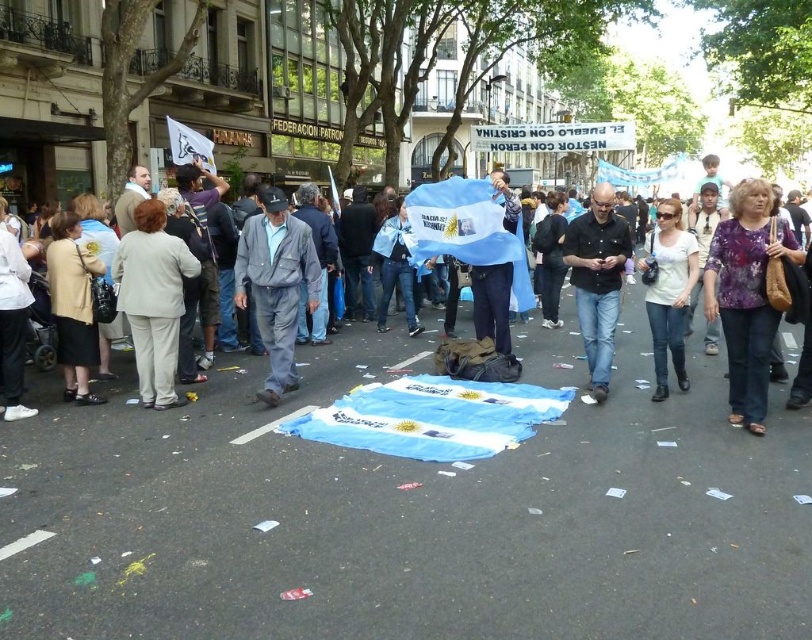
Question: Does blue fabric flag at center have a smaller size compared to black shirt at center?

Choices:
 (A) no
 (B) yes

Answer: (B)

Question: Which point is closer to the camera?

Choices:
 (A) (137, 292)
 (B) (610, 262)
 (C) (257, 394)

Answer: (C)

Question: Is the position of black shirt at center less distant than that of white cotton shirt at center?

Choices:
 (A) no
 (B) yes

Answer: (A)

Question: Does light beige pants at left have a smaller size compared to matte gray suit at center?

Choices:
 (A) yes
 (B) no

Answer: (A)

Question: Among these points, which one is farthest from the camera?

Choices:
 (A) (677, 349)
 (B) (616, 436)
 (C) (612, 289)

Answer: (A)

Question: Which point is farther to the camera?

Choices:
 (A) purple printed blouse at center
 (B) white cotton shirt at center

Answer: (B)